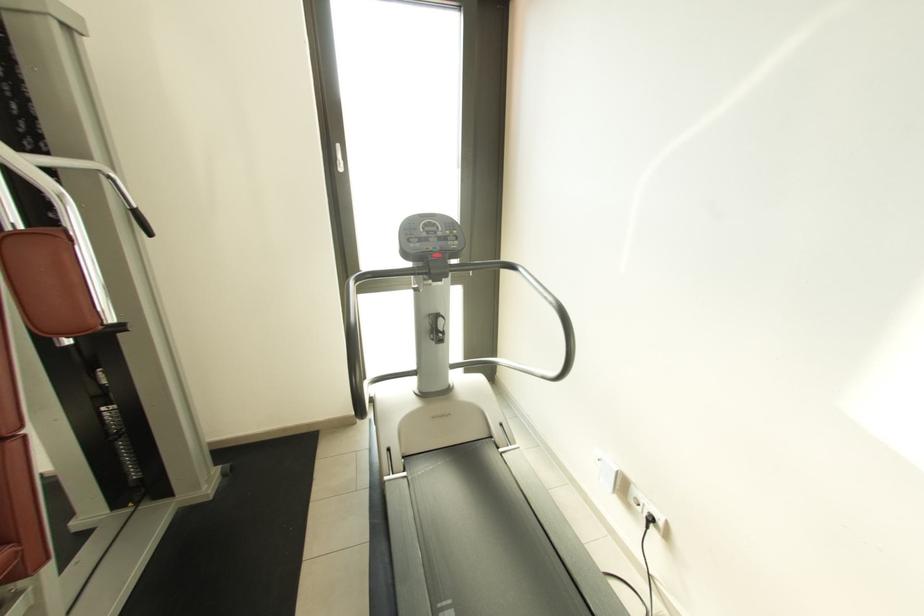
You are a GUI agent. You are given a task and a screenshot of the screen. Output one action in this format:
    pyautogui.click(x=<x>, y=<y>)
    Task: Click on the black machine grip
    This screenshot has height=616, width=924.
    Given the screenshot: What is the action you would take?
    pyautogui.click(x=141, y=222)